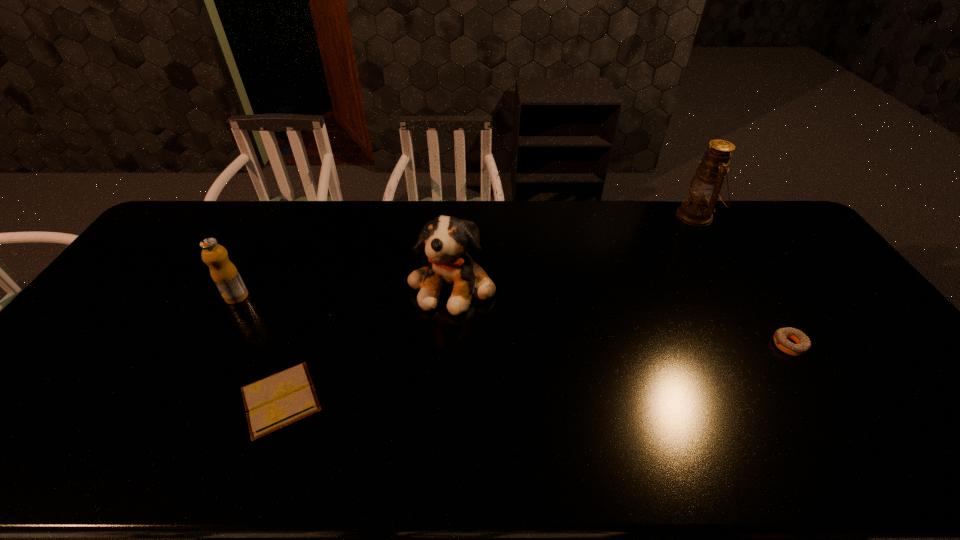
The height and width of the screenshot is (540, 960). Identify the location of object that stands as the second closest to the tallest object. (445, 239).

Locate an element on the screen. This screenshot has width=960, height=540. free point that satisfies the following two spatial constraints: 1. on the front label of the fruit juice; 2. on the left side of the diary is located at coordinates (180, 400).

Where is `vacant region that satisfies the following two spatial constraints: 1. on the front label of the diary; 2. on the right side of the fruit juice`? This screenshot has height=540, width=960. vacant region that satisfies the following two spatial constraints: 1. on the front label of the diary; 2. on the right side of the fruit juice is located at coordinates (180, 400).

Locate an element on the screen. The image size is (960, 540). vacant space that satisfies the following two spatial constraints: 1. on the front label of the nearest object; 2. on the right side of the leftmost object is located at coordinates (180, 400).

The image size is (960, 540). Find the location of `free location that satisfies the following two spatial constraints: 1. on the front label of the doughnut; 2. on the right side of the fruit juice`. free location that satisfies the following two spatial constraints: 1. on the front label of the doughnut; 2. on the right side of the fruit juice is located at coordinates (210, 345).